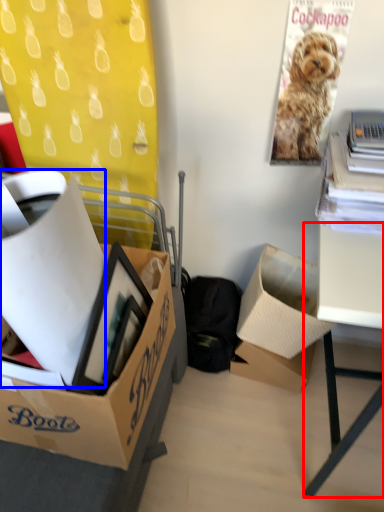
Question: Which object appears closest to the camera in this image, desk (highlighted by a red box) or box (highlighted by a blue box)?

Choices:
 (A) desk
 (B) box

Answer: (B)